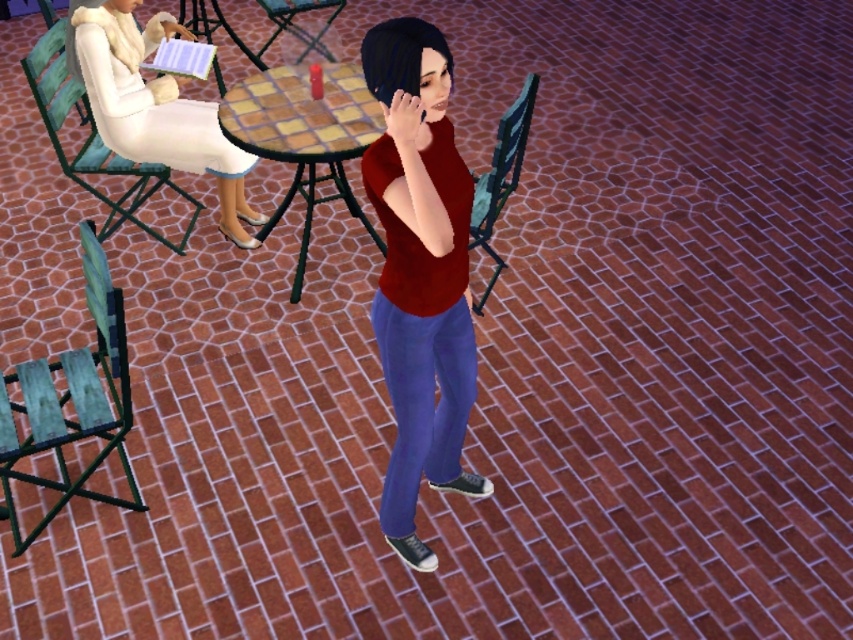
Can you confirm if green fabric chair at lower left is shorter than green fabric chair at center?

Incorrect, green fabric chair at lower left's height does not fall short of green fabric chair at center's.

Does green fabric chair at lower left come in front of green fabric chair at center?

Yes, green fabric chair at lower left is closer to the viewer.

Where is `green fabric chair at lower left`? This screenshot has width=853, height=640. green fabric chair at lower left is located at coordinates (73, 397).

Can you confirm if matte red tank top at center is bigger than green wood chair at upper left?

Yes.

Is matte red tank top at center above green wood chair at upper left?

Actually, matte red tank top at center is below green wood chair at upper left.

Describe the element at coordinates (419, 273) in the screenshot. I see `matte red tank top at center` at that location.

Find the location of a particular element. This screenshot has height=640, width=853. matte red tank top at center is located at coordinates (419, 273).

Who is more forward, [103,237] or [183,22]?

Positioned in front is point [103,237].

At what (x,y) coordinates should I click in order to perform the action: click on white fabric chair at upper left. Please return your answer as a coordinate pair (x, y). Looking at the image, I should click on (91, 138).